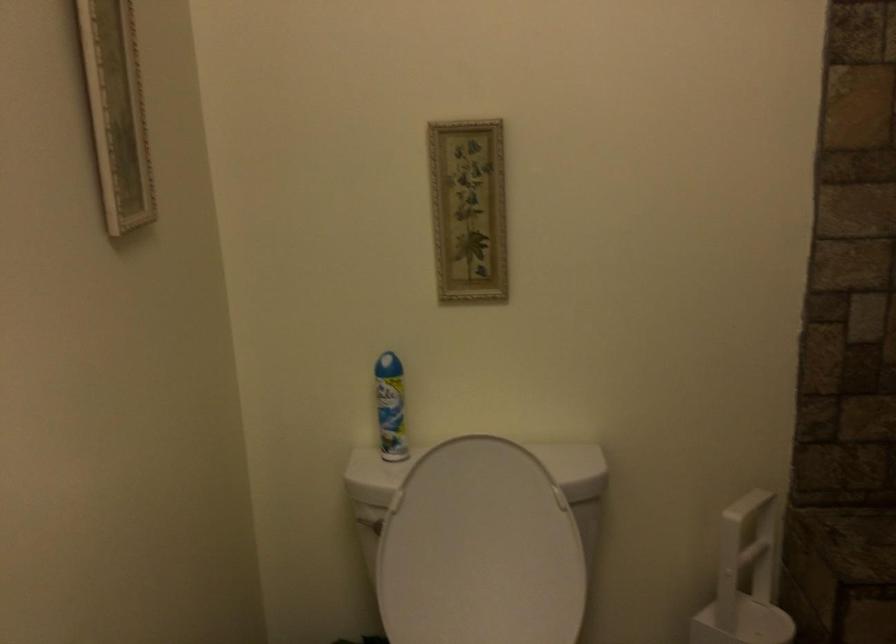
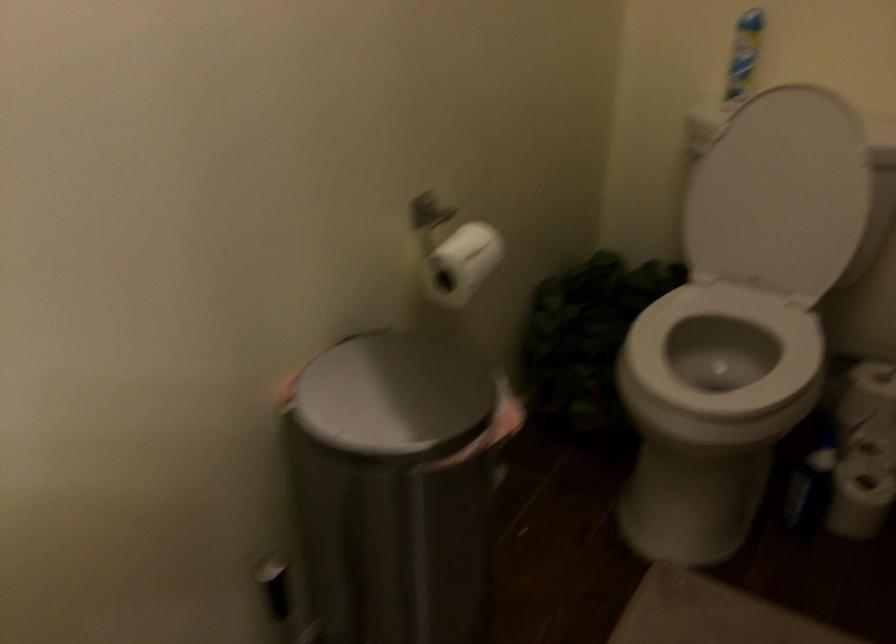
How did the camera likely rotate?

The camera rotated toward left-down.